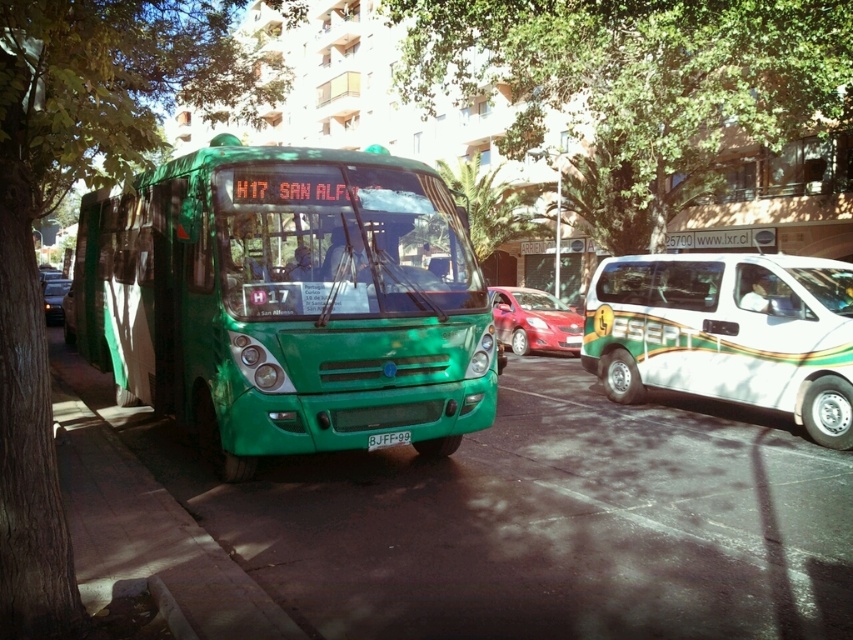
In order to click on green leafy tree at left in this screenshot , I will do `click(57, 202)`.

From the picture: Can you confirm if green leafy tree at left is thinner than black plastic license plate at center?

No.

Is point (142, 17) farther from viewer compared to point (393, 435)?

Yes, it is behind point (393, 435).

I want to click on green leafy tree at left, so click(57, 202).

Can you confirm if green matte bus at center is thinner than green leafy tree at upper center?

Yes, green matte bus at center is thinner than green leafy tree at upper center.

You are a GUI agent. You are given a task and a screenshot of the screen. Output one action in this format:
    pyautogui.click(x=<x>, y=<y>)
    Task: Click on the green matte bus at center
    
    Given the screenshot: What is the action you would take?
    pyautogui.click(x=287, y=301)

Does green matte bus at center have a greater width compared to black plastic license plate at center?

Indeed, green matte bus at center has a greater width compared to black plastic license plate at center.

You are a GUI agent. You are given a task and a screenshot of the screen. Output one action in this format:
    pyautogui.click(x=<x>, y=<y>)
    Task: Click on the green matte bus at center
    This screenshot has height=640, width=853.
    Given the screenshot: What is the action you would take?
    pyautogui.click(x=287, y=301)